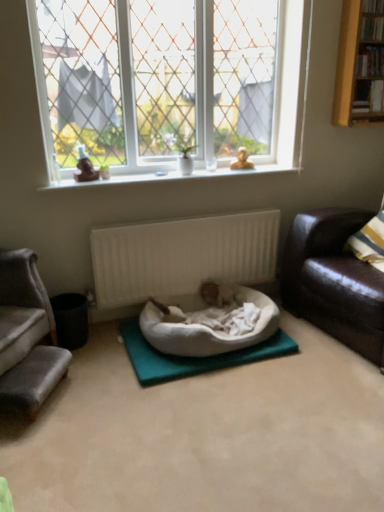
The width and height of the screenshot is (384, 512). In order to click on free location to the right of white fabric yoga mat at center in this screenshot , I will do `click(319, 356)`.